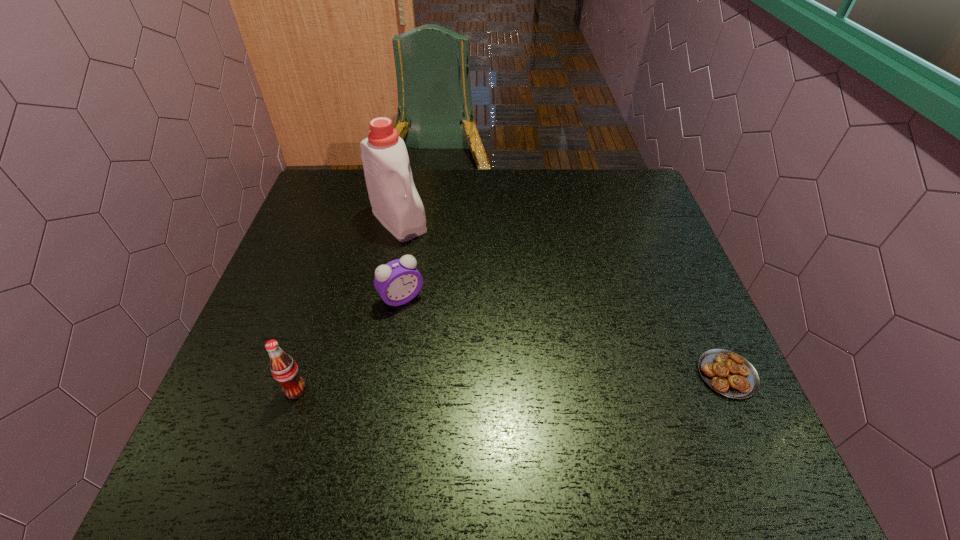
At what (x,y) coordinates should I click in order to perform the action: click on the third shortest object. Please return your answer as a coordinate pair (x, y). Looking at the image, I should click on (284, 369).

Locate an element on the screen. This screenshot has height=540, width=960. soda is located at coordinates [x=284, y=369].

You are a GUI agent. You are given a task and a screenshot of the screen. Output one action in this format:
    pyautogui.click(x=<x>, y=<y>)
    Task: Click on the rightmost object
    The image size is (960, 540).
    Given the screenshot: What is the action you would take?
    pyautogui.click(x=728, y=373)

Find the location of a particular element. The width and height of the screenshot is (960, 540). the shortest object is located at coordinates (728, 373).

The image size is (960, 540). I want to click on detergent, so click(x=395, y=202).

This screenshot has width=960, height=540. Find the location of `the tallest object`. the tallest object is located at coordinates (395, 202).

Where is `alarm clock`? Image resolution: width=960 pixels, height=540 pixels. alarm clock is located at coordinates (397, 282).

Where is `the second shortest object`? the second shortest object is located at coordinates (397, 282).

I want to click on free space located 0.170m on the back of the soda, so click(x=320, y=315).

This screenshot has width=960, height=540. I want to click on vacant space situated 0.340m on the back of the pastry, so click(670, 246).